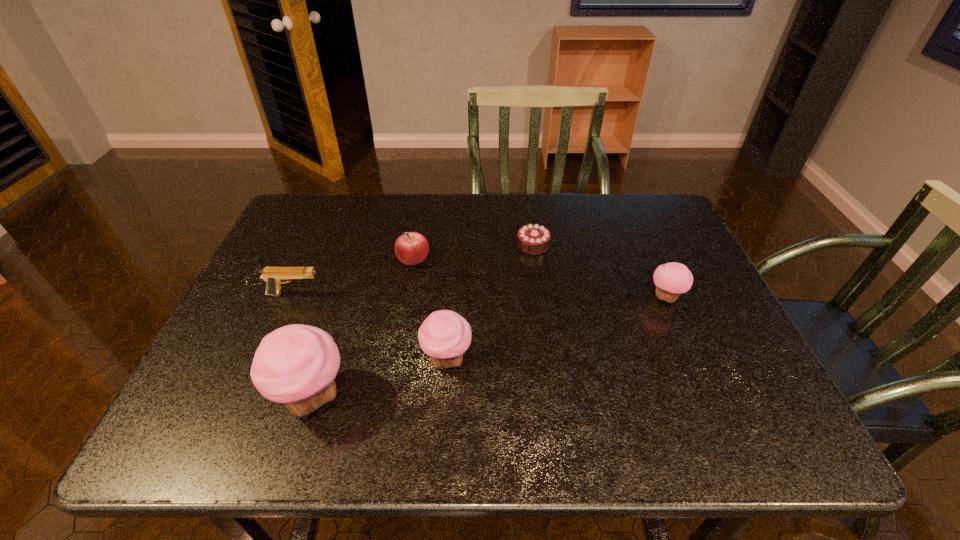
Find the location of `the leftmost cupcake`. the leftmost cupcake is located at coordinates (296, 364).

This screenshot has height=540, width=960. Identify the location of the tallest cupcake. (296, 364).

Identify the location of the second cupcake from right to left. The height and width of the screenshot is (540, 960). (444, 335).

Locate an element on the screen. The height and width of the screenshot is (540, 960). the second tallest object is located at coordinates (444, 335).

Locate an element on the screen. the rightmost object is located at coordinates (671, 279).

Locate an element on the screen. the shortest cupcake is located at coordinates (671, 279).

Locate an element on the screen. The width and height of the screenshot is (960, 540). apple is located at coordinates (411, 248).

This screenshot has height=540, width=960. I want to click on pistol, so click(x=273, y=276).

Identify the location of chocolate cake. Image resolution: width=960 pixels, height=540 pixels. (533, 239).

Locate an element on the screen. The width and height of the screenshot is (960, 540). the second object from right to left is located at coordinates (533, 239).